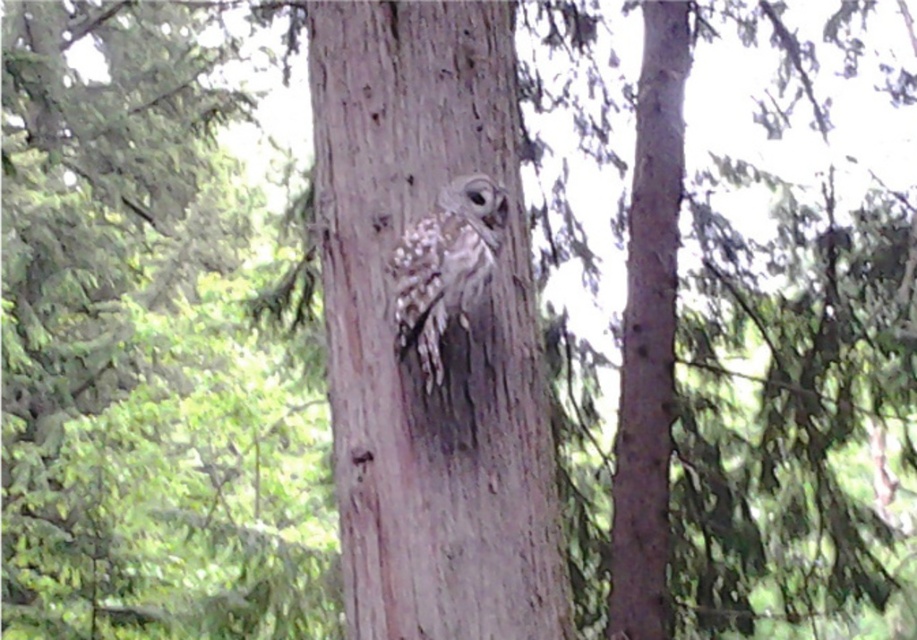
Question: Is smooth bark tree trunk at center further to the viewer compared to speckled feathered owl at center?

Choices:
 (A) yes
 (B) no

Answer: (A)

Question: Which of these objects is positioned closest to the speckled feathered owl at center?

Choices:
 (A) smooth brown tree trunk at center
 (B) smooth bark tree trunk at center

Answer: (A)

Question: Which point appears farthest from the camera in this image?

Choices:
 (A) (663, 275)
 (B) (526, 332)
 (C) (435, 211)

Answer: (A)

Question: Is smooth brown tree trunk at center to the right of smooth bark tree trunk at center from the viewer's perspective?

Choices:
 (A) yes
 (B) no

Answer: (B)

Question: Which of the following is the farthest from the observer?

Choices:
 (A) smooth brown tree trunk at center
 (B) speckled feathered owl at center
 (C) smooth bark tree trunk at center

Answer: (C)

Question: Is smooth brown tree trunk at center above speckled feathered owl at center?

Choices:
 (A) no
 (B) yes

Answer: (A)